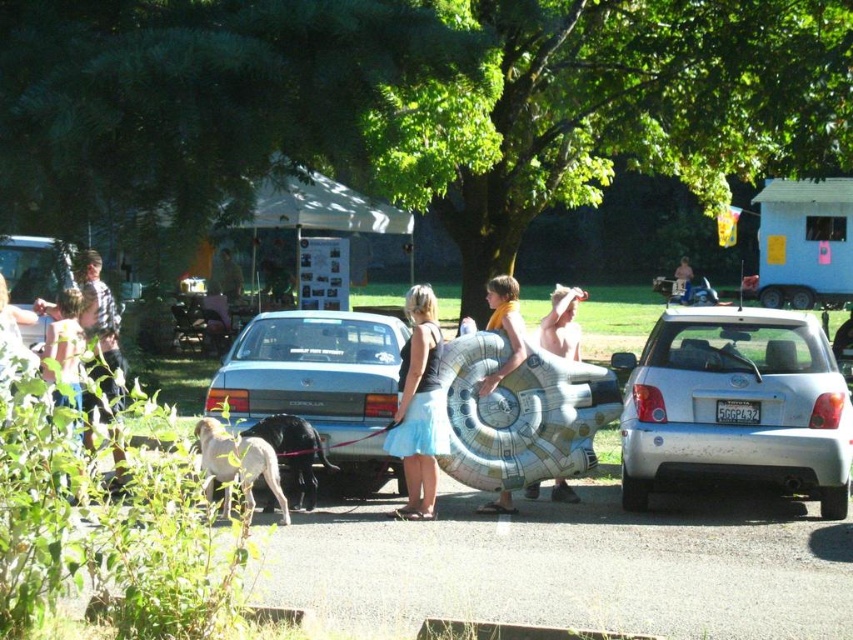
Question: Can you confirm if silver metallic car at center is positioned above matte silver car at center?

Choices:
 (A) yes
 (B) no

Answer: (B)

Question: From the image, what is the correct spatial relationship of white matte hatchback at right in relation to black satin skirt at center?

Choices:
 (A) right
 (B) left

Answer: (A)

Question: Which point is farther to the camera?

Choices:
 (A) black fur dog at center
 (B) black rubber tire at rear right
 (C) silver metallic car at center
 (D) black satin skirt at center

Answer: (B)

Question: Considering the real-world distances, which object is closest to the white matte hatchback at right?

Choices:
 (A) matte silver car at center
 (B) black fur dog at center
 (C) light brown fur at center
 (D) black rubber tire at rear right

Answer: (A)

Question: Is silver metallic car at center smaller than matte silver car at center?

Choices:
 (A) yes
 (B) no

Answer: (A)

Question: Which object is the farthest from the silver metallic car at center?

Choices:
 (A) black rubber tire at rear right
 (B) light brown fur at center
 (C) matte silver car at center
 (D) black satin skirt at center

Answer: (A)